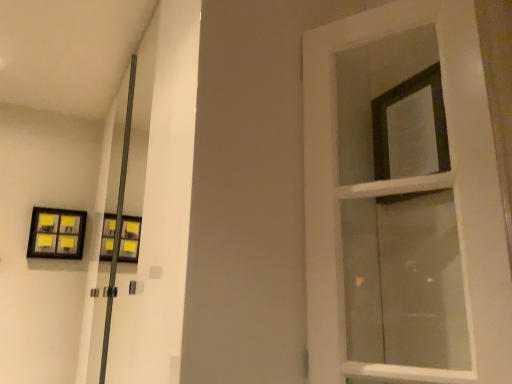
Question: Is matte black picture frame at upper left situated inside white wooden door at right or outside?

Choices:
 (A) inside
 (B) outside

Answer: (B)

Question: From the image's perspective, is matte black picture frame at upper left positioned above or below white wooden door at right?

Choices:
 (A) above
 (B) below

Answer: (B)

Question: Estimate the real-world distances between objects in this image. Which object is farther from the black matte frame at upper right?

Choices:
 (A) white wooden door at right
 (B) matte black picture frame at upper left

Answer: (B)

Question: Estimate the real-world distances between objects in this image. Which object is farther from the white wooden door at right?

Choices:
 (A) black matte frame at upper right
 (B) matte black picture frame at upper left

Answer: (B)